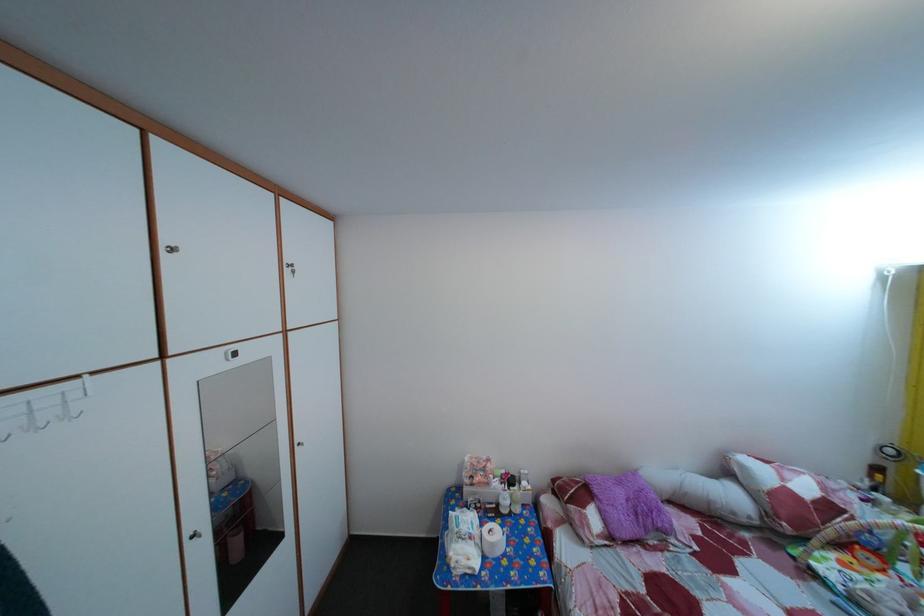
What do you see at coordinates (43, 408) in the screenshot?
I see `a white wall hook` at bounding box center [43, 408].